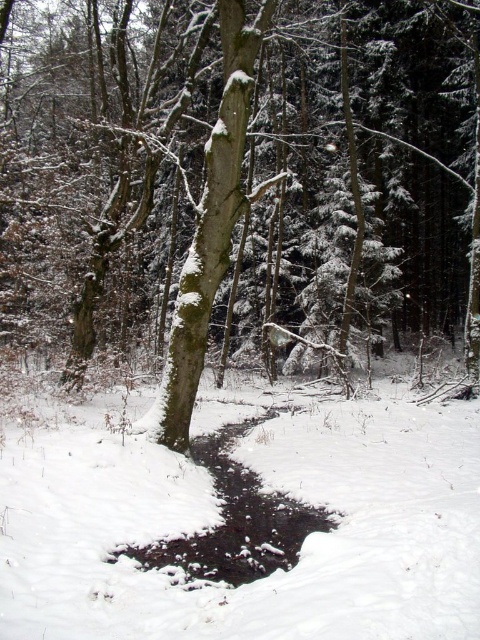
Question: Estimate the real-world distances between objects in this image. Which object is farther from the white textured bark at center?

Choices:
 (A) snow-covered tree at center
 (B) black ice puddle at lower center

Answer: (A)

Question: Which point is closer to the camera taking this photo?

Choices:
 (A) (233, 209)
 (B) (475, 412)
 (C) (176, 564)

Answer: (C)

Question: Can you confirm if snow-covered tree at center is positioned to the right of white powdery snow at center?

Choices:
 (A) yes
 (B) no

Answer: (A)

Question: Which of the following is the closest to the observer?

Choices:
 (A) (111, 298)
 (B) (176, 442)
 (C) (72, 609)
 (D) (252, 474)

Answer: (C)

Question: Does white powdery snow at center have a lesser width compared to black ice puddle at lower center?

Choices:
 (A) yes
 (B) no

Answer: (B)

Question: Can you confirm if snow-covered tree at center is positioned below black ice puddle at lower center?

Choices:
 (A) no
 (B) yes

Answer: (A)